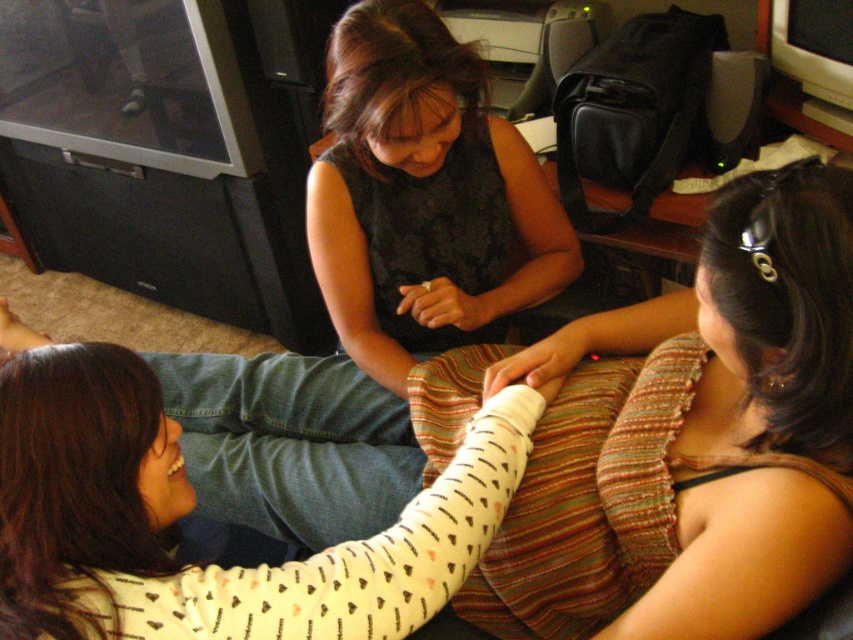
Is point (346, 490) closer to viewer compared to point (450, 320)?

Yes.

Between black textured dress at center and matte black hands at center, which one has more height?

black textured dress at center

Which is in front, point (392, 422) or point (399, 291)?

Point (392, 422) is more forward.

This screenshot has width=853, height=640. In order to click on black textured dress at center in this screenshot , I will do `click(726, 348)`.

Which is in front, point (409, 556) or point (538, 294)?

Point (409, 556)

Describe the element at coordinates (164, 512) in the screenshot. I see `white dotted sweater at lower left` at that location.

Between point (242, 568) and point (532, 180), which one is positioned in front?

Positioned in front is point (242, 568).

Identify the location of white dotted sweater at lower left. (164, 512).

Does matte black hands at center have a lesser height compared to white matte hand at lower left?

Yes, matte black hands at center is shorter than white matte hand at lower left.

Measure the distance between matte black hands at center and white matte hand at lower left.

48.60 centimeters

You are a GUI agent. You are given a task and a screenshot of the screen. Output one action in this format:
    pyautogui.click(x=<x>, y=<y>)
    Task: Click on the matte black hands at center
    This screenshot has height=640, width=853.
    Given the screenshot: What is the action you would take?
    pyautogui.click(x=445, y=305)

The height and width of the screenshot is (640, 853). Identify the location of matte black hands at center. (445, 305).